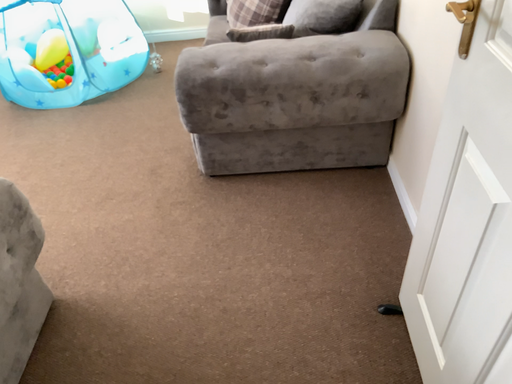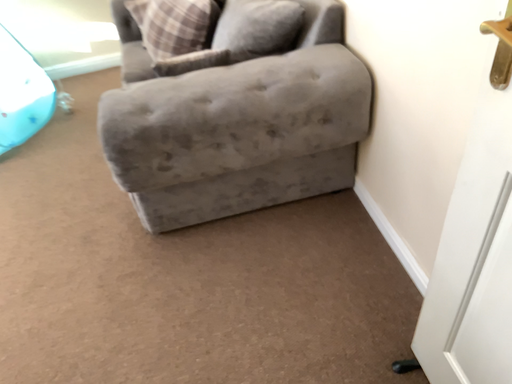
Question: Which way did the camera rotate in the video?

Choices:
 (A) rotated right
 (B) rotated left

Answer: (A)